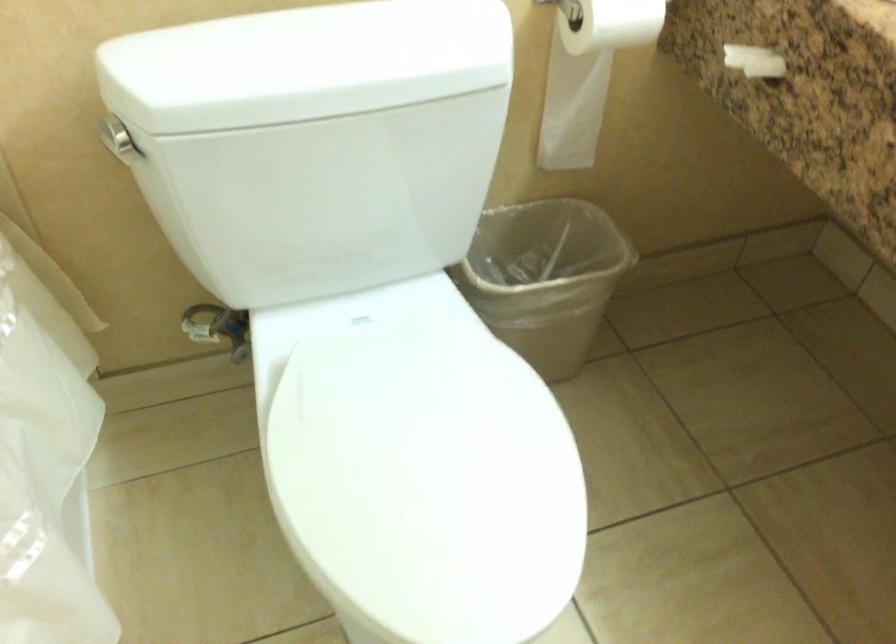
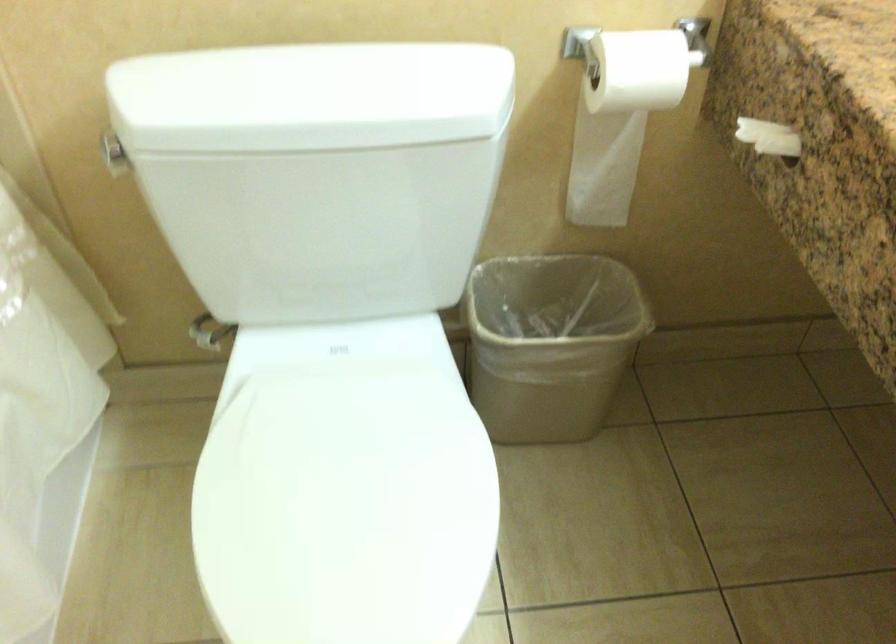
Question: The first image is from the beginning of the video and the second image is from the end. How did the camera likely rotate when shooting the video?

Choices:
 (A) Left
 (B) Right
 (C) Up
 (D) Down

Answer: (A)